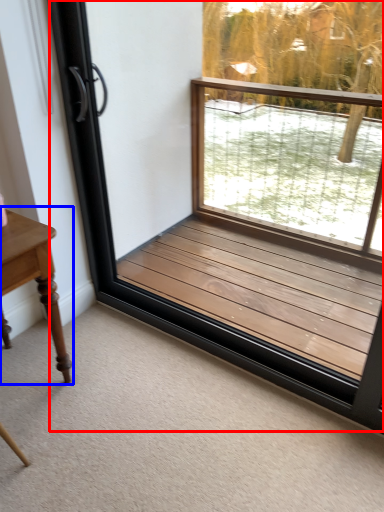
Question: Which point is closer to the camera, window frame (highlighted by a red box) or table (highlighted by a blue box)?

Choices:
 (A) window frame
 (B) table

Answer: (A)